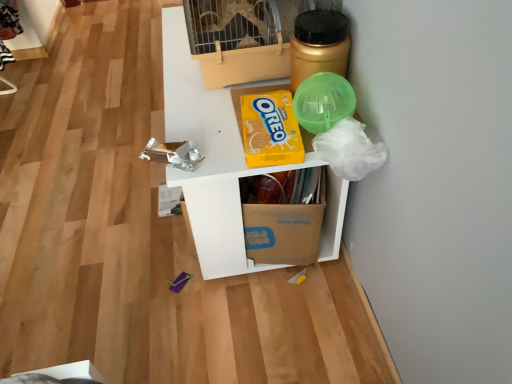
Where is `brown cardboard box at center`? This screenshot has height=384, width=512. brown cardboard box at center is located at coordinates (283, 232).

Image resolution: width=512 pixels, height=384 pixels. In order to click on beige plastic birdcage at upper center in this screenshot , I will do `click(245, 37)`.

The image size is (512, 384). Find the location of `white cardboard box at upper center`. white cardboard box at upper center is located at coordinates 210,156.

What do you see at coordinates (319, 45) in the screenshot? The height and width of the screenshot is (384, 512). I see `gold metallic jar at upper right` at bounding box center [319, 45].

Locate an element on the screen. brown cardboard box at center is located at coordinates (283, 232).

You are a GUI agent. You are given a task and a screenshot of the screen. Output one action in this format:
    pyautogui.click(x=<x>, y=<y>)
    Task: Click on the bird cage located on the left of gold metallic jar at upper right
    
    Given the screenshot: What is the action you would take?
    pyautogui.click(x=245, y=37)

Which object is thinner, beige plastic birdcage at upper center or gold metallic jar at upper right?

Thinner between the two is gold metallic jar at upper right.

Choose the correct answer: Is beige plastic birdcage at upper center inside gold metallic jar at upper right or outside it?

beige plastic birdcage at upper center exists outside the volume of gold metallic jar at upper right.

Which is more to the left, beige plastic birdcage at upper center or gold metallic jar at upper right?

From the viewer's perspective, beige plastic birdcage at upper center appears more on the left side.

Based on the photo, between brown cardboard box at center and yellow cardboard oreo at upper center, which one has larger width?

brown cardboard box at center.

From a real-world perspective, relative to yellow cardboard oreo at upper center, is brown cardboard box at center vertically above or below?

brown cardboard box at center is situated lower than yellow cardboard oreo at upper center in the real world.

From the image's perspective, which one is positioned lower, brown cardboard box at center or yellow cardboard oreo at upper center?

brown cardboard box at center is shown below in the image.

Is the position of brown cardboard box at center less distant than that of yellow cardboard oreo at upper center?

No.

At what (x,y) coordinates should I click in order to perform the action: click on cereal below the beige plastic birdcage at upper center (from a real-world perspective). Please return your answer as a coordinate pair (x, y). This screenshot has width=512, height=384. Looking at the image, I should click on (270, 130).

Is beige plastic birdcage at upper center positioned with its back to yellow cardboard oreo at upper center?

beige plastic birdcage at upper center does not have its back to yellow cardboard oreo at upper center.

How many degrees apart are the facing directions of beige plastic birdcage at upper center and yellow cardboard oreo at upper center?

3.05e-05 degrees separate the facing orientations of beige plastic birdcage at upper center and yellow cardboard oreo at upper center.

Who is smaller, gold metallic jar at upper right or beige plastic birdcage at upper center?

gold metallic jar at upper right.

Is gold metallic jar at upper right aimed at beige plastic birdcage at upper center?

No, gold metallic jar at upper right is not turned towards beige plastic birdcage at upper center.

From a real-world perspective, is gold metallic jar at upper right positioned above or below beige plastic birdcage at upper center?

In terms of real-world spatial position, gold metallic jar at upper right is below beige plastic birdcage at upper center.

Which is correct: gold metallic jar at upper right is inside beige plastic birdcage at upper center, or outside of it?

gold metallic jar at upper right lies outside beige plastic birdcage at upper center.

Which of these two, white cardboard box at upper center or gold metallic jar at upper right, is thinner?

gold metallic jar at upper right.

How much distance is there between white cardboard box at upper center and gold metallic jar at upper right?

white cardboard box at upper center is 11.31 inches from gold metallic jar at upper right.

The image size is (512, 384). In order to click on bottle behind the white cardboard box at upper center in this screenshot , I will do `click(319, 45)`.

From the picture: Is white cardboard box at upper center outside of gold metallic jar at upper right?

Absolutely, white cardboard box at upper center is external to gold metallic jar at upper right.

Looking at the image, does white cardboard box at upper center seem bigger or smaller compared to beige plastic birdcage at upper center?

white cardboard box at upper center is bigger than beige plastic birdcage at upper center.

From a real-world perspective, is white cardboard box at upper center positioned over beige plastic birdcage at upper center based on gravity?

Incorrect, from a real-world perspective, white cardboard box at upper center is lower than beige plastic birdcage at upper center.

From the picture: In terms of width, does white cardboard box at upper center look wider or thinner when compared to beige plastic birdcage at upper center?

white cardboard box at upper center is wider than beige plastic birdcage at upper center.

Would you say white cardboard box at upper center is to the left or to the right of brown cardboard box at center in the picture?

Based on their positions, white cardboard box at upper center is located to the left of brown cardboard box at center.

Between white cardboard box at upper center and brown cardboard box at center, which one has larger size?

white cardboard box at upper center is bigger.

Considering the positions of points (348, 183) and (264, 257), is point (348, 183) closer to camera compared to point (264, 257)?

Yes, point (348, 183) is closer to viewer.

Identify the location of furniture on the left side of brown cardboard box at center. This screenshot has height=384, width=512. coord(210,156).

There is a gold metallic jar at upper right. Identify the location of bird cage above it (from a real-world perspective). The height and width of the screenshot is (384, 512). (245, 37).

What are the coordinates of `cereal located above the brown cardboard box at center (from the image's perspective)` in the screenshot? It's located at (270, 130).

Estimate the real-world distances between objects in this image. Which object is further from white cardboard box at upper center, brown cardboard box at center or yellow cardboard oreo at upper center?

yellow cardboard oreo at upper center.

Considering their positions, is white cardboard box at upper center positioned further to beige plastic birdcage at upper center than brown cardboard box at center?

brown cardboard box at center.

Based on their spatial positions, is yellow cardboard oreo at upper center or white cardboard box at upper center closer to gold metallic jar at upper right?

yellow cardboard oreo at upper center.

Estimate the real-world distances between objects in this image. Which object is further from yellow cardboard oreo at upper center, gold metallic jar at upper right or brown cardboard box at center?

brown cardboard box at center is positioned further to the anchor yellow cardboard oreo at upper center.

Based on their spatial positions, is beige plastic birdcage at upper center or brown cardboard box at center closer to yellow cardboard oreo at upper center?

beige plastic birdcage at upper center.

In the scene shown: Based on their spatial positions, is beige plastic birdcage at upper center or yellow cardboard oreo at upper center closer to gold metallic jar at upper right?

beige plastic birdcage at upper center is positioned closer to the anchor gold metallic jar at upper right.

Estimate the real-world distances between objects in this image. Which object is closer to gold metallic jar at upper right, white cardboard box at upper center or beige plastic birdcage at upper center?

Among the two, beige plastic birdcage at upper center is located nearer to gold metallic jar at upper right.

Which object lies nearer to the anchor point brown cardboard box at center, beige plastic birdcage at upper center or gold metallic jar at upper right?

Based on the image, gold metallic jar at upper right appears to be nearer to brown cardboard box at center.

Identify the location of bottle that lies between beige plastic birdcage at upper center and yellow cardboard oreo at upper center from top to bottom. This screenshot has width=512, height=384. (319, 45).

Where is `bottle between beige plastic birdcage at upper center and white cardboard box at upper center from top to bottom`? bottle between beige plastic birdcage at upper center and white cardboard box at upper center from top to bottom is located at coordinates (319, 45).

Where is `bottle between beige plastic birdcage at upper center and brown cardboard box at center from top to bottom`? This screenshot has width=512, height=384. bottle between beige plastic birdcage at upper center and brown cardboard box at center from top to bottom is located at coordinates (319, 45).

Locate an element on the screen. furniture between beige plastic birdcage at upper center and yellow cardboard oreo at upper center in the up-down direction is located at coordinates (210, 156).